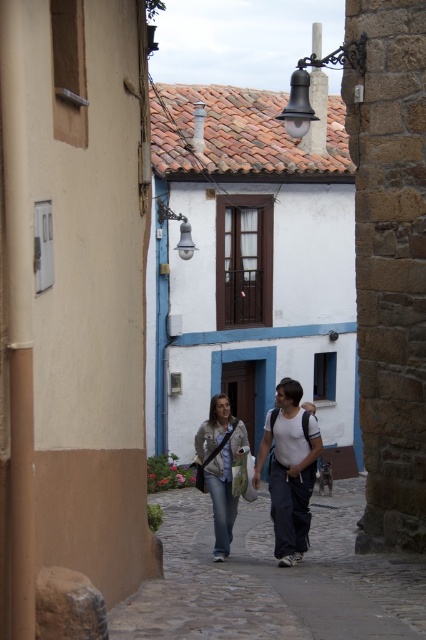
Question: Can you confirm if denim jeans at center is positioned below denim jacket at center?

Choices:
 (A) no
 (B) yes

Answer: (A)

Question: Which object is farther from the camera taking this photo?

Choices:
 (A) denim jeans at center
 (B) denim jacket at center

Answer: (B)

Question: Which point is farther to the camera?

Choices:
 (A) (302, 516)
 (B) (236, 435)

Answer: (B)

Question: Does denim jeans at center have a smaller size compared to denim jacket at center?

Choices:
 (A) yes
 (B) no

Answer: (B)

Question: Which of the following is the farthest from the observer?

Choices:
 (A) denim jeans at center
 (B) denim jacket at center

Answer: (B)

Question: Is denim jeans at center to the left of denim jacket at center from the viewer's perspective?

Choices:
 (A) no
 (B) yes

Answer: (A)